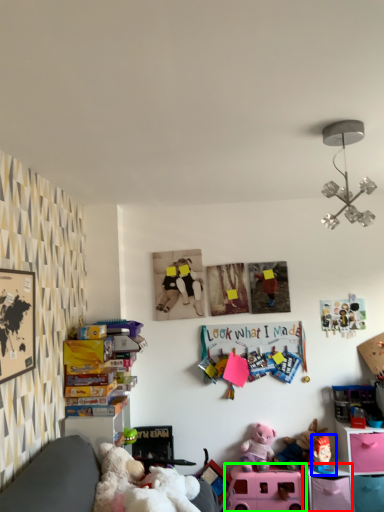
Question: Which is farther away from shelf (highlighted by a red box)? toy (highlighted by a blue box) or toy (highlighted by a green box)?

Choices:
 (A) toy
 (B) toy

Answer: (B)